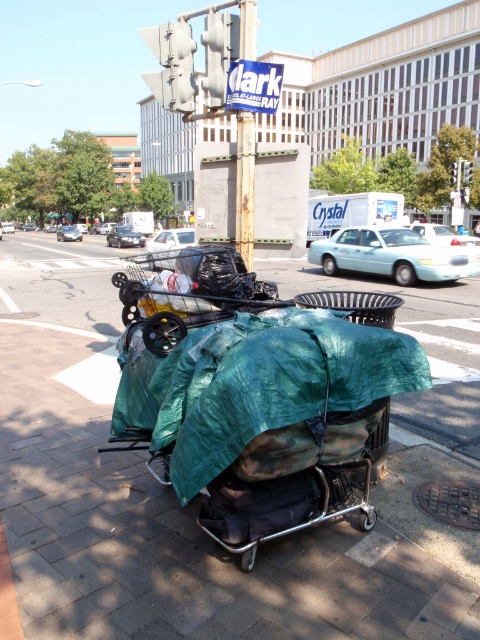
Question: Is green tarpaulin at center to the left of green fabric trolley at center from the viewer's perspective?

Choices:
 (A) no
 (B) yes

Answer: (A)

Question: Which of the following is the closest to the observer?

Choices:
 (A) green fabric trolley at center
 (B) green tarpaulin at center

Answer: (B)

Question: From the image, what is the correct spatial relationship of green tarpaulin at center in relation to green fabric trolley at center?

Choices:
 (A) above
 (B) below

Answer: (B)

Question: Which point is farther from the camera taking this photo?

Choices:
 (A) (233, 282)
 (B) (119, 474)

Answer: (B)

Question: Can you confirm if green tarpaulin at center is thinner than green fabric trolley at center?

Choices:
 (A) no
 (B) yes

Answer: (A)